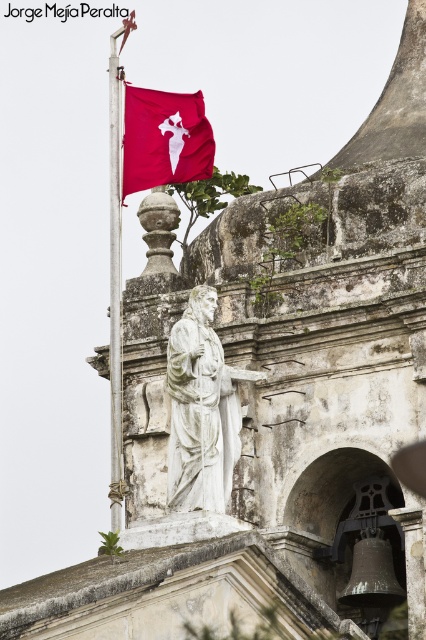
Question: Among these objects, which one is nearest to the camera?

Choices:
 (A) metallic flag pole at upper left
 (B) white marble statue at center
 (C) matte red flag at upper left

Answer: (B)

Question: Which is nearer to the metallic flag pole at upper left?

Choices:
 (A) white marble statue at center
 (B) matte red flag at upper left

Answer: (A)

Question: Is matte red flag at upper left to the left of metallic flag pole at upper left from the viewer's perspective?

Choices:
 (A) yes
 (B) no

Answer: (B)

Question: Among these objects, which one is farthest from the camera?

Choices:
 (A) matte red flag at upper left
 (B) metallic flag pole at upper left
 (C) white marble statue at center

Answer: (A)

Question: Is the position of white marble statue at center less distant than that of metallic flag pole at upper left?

Choices:
 (A) yes
 (B) no

Answer: (A)

Question: Can you confirm if white marble statue at center is bigger than matte red flag at upper left?

Choices:
 (A) no
 (B) yes

Answer: (B)